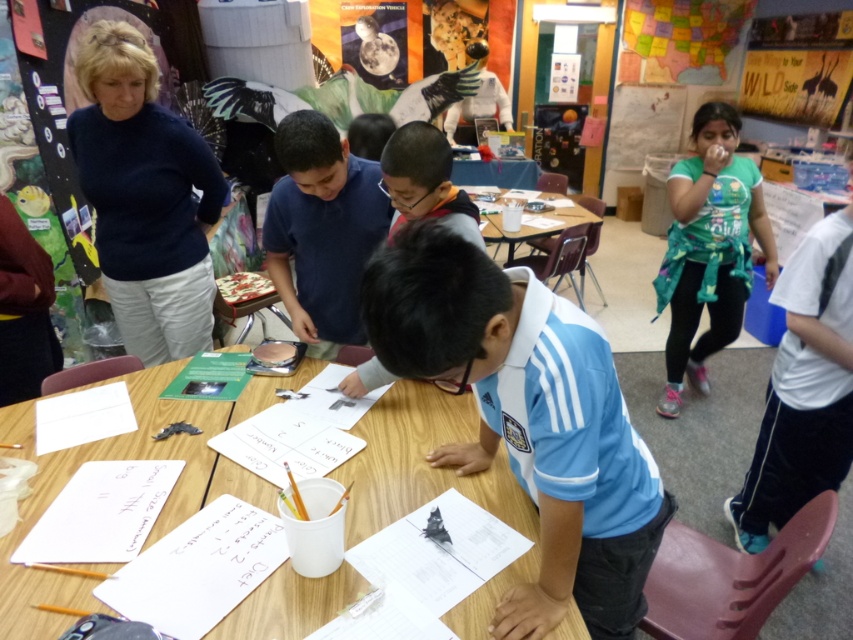
You are a teacher in the classroom and need to hang a large poster on the wall. You have two options for hanging hooks available in the room. The first is the blue jersey at center, and the second is the blue cotton shirt at center. Which hook is more suitable for holding the heavy poster?

The blue jersey at center is much taller than the blue cotton shirt at center, so it can support the heavy poster better.